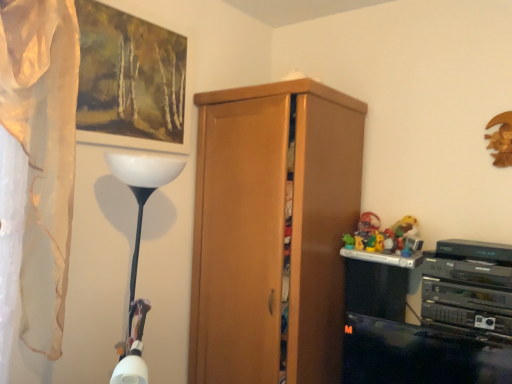
Measure the distance between point (x=41, y=303) and camera.

1.50 meters.

Identify the location of wooden picture frame at upper left. (130, 80).

Which of these two, white sheer curtain at left or wooden cabinet at center, stands shorter?

white sheer curtain at left.

Is point (55, 79) in front of point (258, 263)?

Yes.

Is white sheer curtain at left positioned with its back to wooden cabinet at center?

That's not correct — white sheer curtain at left is not looking away from wooden cabinet at center.

Can you tell me how much white sheer curtain at left and wooden cabinet at center differ in facing direction?

The facing directions of white sheer curtain at left and wooden cabinet at center are 90 degrees apart.

Does wooden picture frame at upper left touch white sheer curtain at left?

No, wooden picture frame at upper left is not with white sheer curtain at left.

Find the location of a particular element. The image size is (512, 384). picture frame above the white sheer curtain at left (from the image's perspective) is located at coordinates (130, 80).

How different are the orientations of wooden picture frame at upper left and white sheer curtain at left in degrees?

They differ by 0.0021 degrees in their facing directions.

From a real-world perspective, which object rests below the other?

In real-world perspective, wooden cabinet at center is lower.

Does point (79, 9) appear closer or farther from the camera than point (265, 381)?

Point (79, 9) is positioned closer to the camera compared to point (265, 381).

Is wooden picture frame at upper left surrounding wooden cabinet at center?

Actually, wooden cabinet at center is outside wooden picture frame at upper left.

From the image's perspective, which one is positioned higher, wooden picture frame at upper left or wooden cabinet at center?

wooden picture frame at upper left.

How far apart are wooden cabinet at center and white sheer curtain at left?

wooden cabinet at center and white sheer curtain at left are 32.91 inches apart.

Between wooden cabinet at center and white sheer curtain at left, which one has larger size?

Bigger between the two is wooden cabinet at center.

Consider the image. Relative to white sheer curtain at left, is wooden cabinet at center in front or behind?

wooden cabinet at center is positioned farther from the viewer than white sheer curtain at left.

Are wooden cabinet at center and white sheer curtain at left located far from each other?

wooden cabinet at center is near white sheer curtain at left, not far away.

How many degrees apart are the facing directions of wooden cabinet at center and wooden picture frame at upper left?

The facing directions of wooden cabinet at center and wooden picture frame at upper left are 90 degrees apart.

The image size is (512, 384). What are the coordinates of `picture frame above the wooden cabinet at center (from a real-world perspective)` in the screenshot? It's located at (130, 80).

Which is closer to the camera, (220, 336) or (153, 144)?

The point (153, 144) is closer.

Between wooden cabinet at center and wooden picture frame at upper left, which one has less height?

wooden picture frame at upper left.

Identify the location of picture frame that is on the right side of white sheer curtain at left. The width and height of the screenshot is (512, 384). (130, 80).

From a real-world perspective, which is physically above, white sheer curtain at left or wooden picture frame at upper left?

In real-world perspective, wooden picture frame at upper left is above.

From the picture: In the image, is white sheer curtain at left positioned in front of or behind wooden picture frame at upper left?

Visually, white sheer curtain at left is located in front of wooden picture frame at upper left.

Which of these two, white sheer curtain at left or wooden picture frame at upper left, is smaller?

wooden picture frame at upper left is smaller.

Locate an element on the screen. The width and height of the screenshot is (512, 384). cabinetry that appears below the white sheer curtain at left (from a real-world perspective) is located at coordinates (272, 230).

Find the location of a particular element. The width and height of the screenshot is (512, 384). picture frame that is above the white sheer curtain at left (from the image's perspective) is located at coordinates (130, 80).

Estimate the real-world distances between objects in this image. Which object is further from wooden cabinet at center, wooden picture frame at upper left or white sheer curtain at left?

Based on the image, white sheer curtain at left appears to be further to wooden cabinet at center.

Considering their positions, is wooden cabinet at center positioned closer to wooden picture frame at upper left than white sheer curtain at left?

white sheer curtain at left is closer to wooden picture frame at upper left.

Which object lies further to the anchor point wooden picture frame at upper left, white sheer curtain at left or wooden cabinet at center?

wooden cabinet at center lies further to wooden picture frame at upper left than the other object.

Looking at the image, which one is located further to wooden cabinet at center, white sheer curtain at left or wooden picture frame at upper left?

white sheer curtain at left is further to wooden cabinet at center.

From the image, which object appears to be nearer to white sheer curtain at left, wooden picture frame at upper left or wooden cabinet at center?

wooden picture frame at upper left lies closer to white sheer curtain at left than the other object.

Consider the image. Based on their spatial positions, is wooden cabinet at center or wooden picture frame at upper left closer to white sheer curtain at left?

The object closer to white sheer curtain at left is wooden picture frame at upper left.

Locate an element on the screen. The height and width of the screenshot is (384, 512). curtain that lies between wooden picture frame at upper left and wooden cabinet at center from top to bottom is located at coordinates (42, 153).